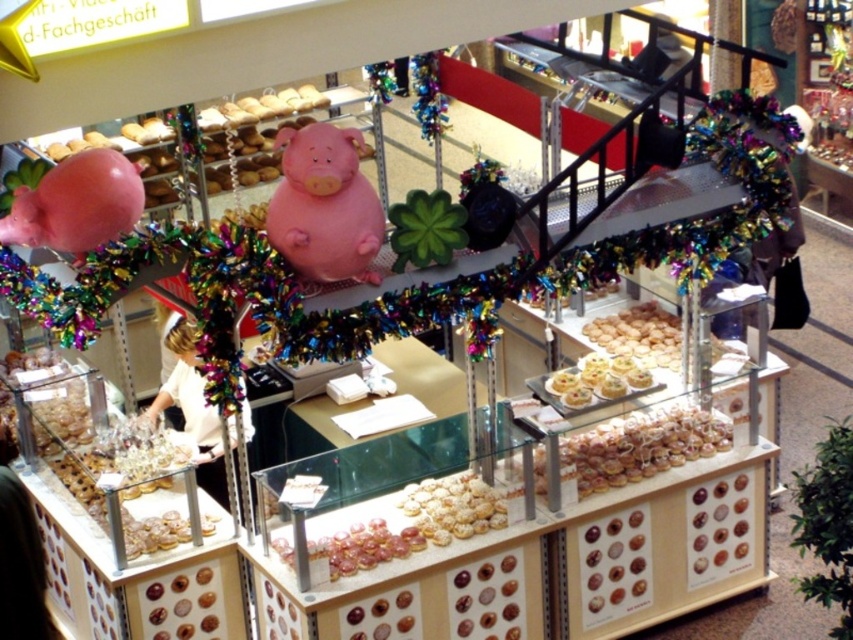
You are a customer at the bakery and want to grab the pink matte balloon at left and the glazed doughnut at center. Which item will you reach first if you approach the display from the front?

The pink matte balloon at left is closer to the viewer than the glazed doughnut at center, so you will reach the pink matte balloon at left first.

You are a customer standing in front of the bakery display. You want to place a new donut decoration at the exact center of the display. Is the pink matte piggy bank at center currently occupying that spot?

The pink matte piggy bank at center is located at point (325, 205), which indicates it is positioned at the center of the display. Therefore, the piggy bank is occupying the exact center, so placing the new donut decoration there would require moving the piggy bank.